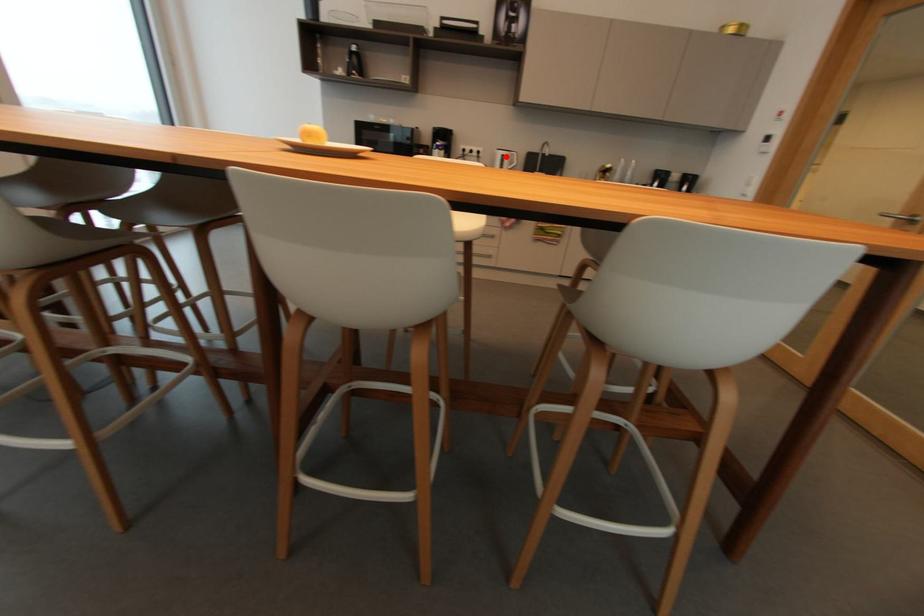
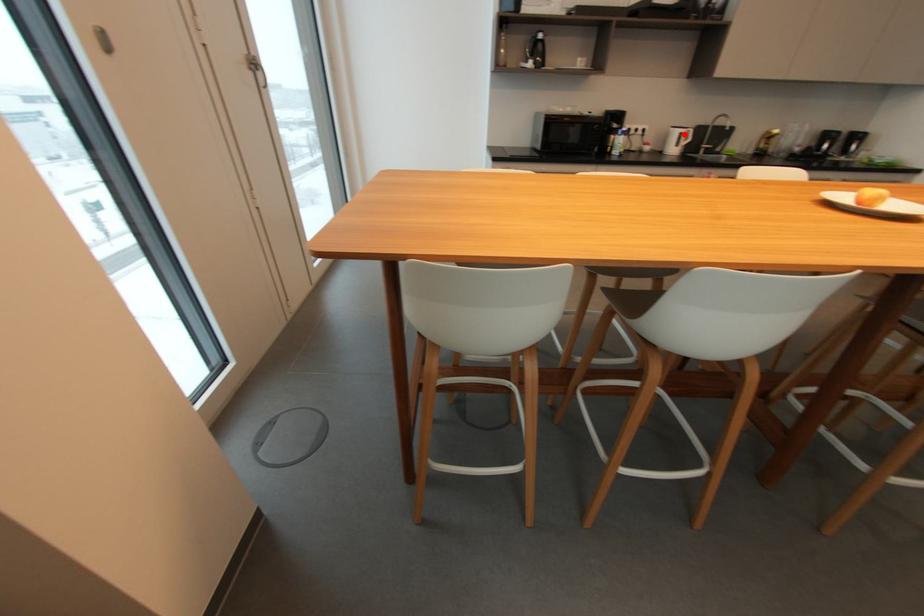
I am providing you with two images of the same scene from different viewpoints. A red point is marked on the first image and another point is marked on the second image. Does the point marked in image1 correspond to the same location as the one in image2?

Yes